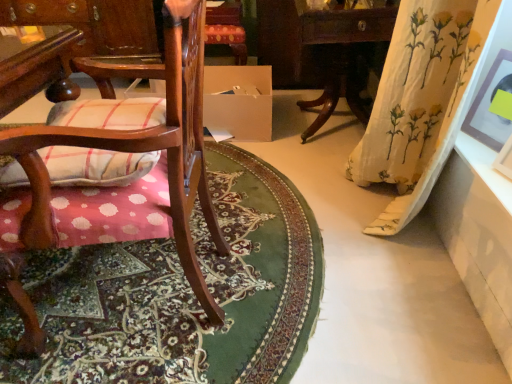
This screenshot has width=512, height=384. Identify the location of matte brown picture frame at upper right. (489, 105).

Image resolution: width=512 pixels, height=384 pixels. In order to click on wooden chair with cushion at left in this screenshot , I will do `click(114, 165)`.

The width and height of the screenshot is (512, 384). Find the location of `white glossy table at lower right, which ranks as the third table in back-to-front order`. white glossy table at lower right, which ranks as the third table in back-to-front order is located at coordinates (479, 234).

The height and width of the screenshot is (384, 512). I want to click on white floral fabric curtain at right, so click(420, 89).

Is carpeted floor mat at lower left positioned beyond the bounds of white cardboard box at center?

Yes, carpeted floor mat at lower left is not within white cardboard box at center.

From a real-world perspective, which is physically above, carpeted floor mat at lower left or white cardboard box at center?

white cardboard box at center, from a real-world perspective.

I want to click on cardboard box above the carpeted floor mat at lower left (from the image's perspective), so click(239, 101).

Between carpeted floor mat at lower left and white cardboard box at center, which one has more height?

white cardboard box at center is taller.

Is wooden table at left, arranged as the third table when viewed from the front, taller or shorter than wooden chair with cushion at left?

wooden table at left, arranged as the third table when viewed from the front, is shorter than wooden chair with cushion at left.

How different are the orientations of wooden table at left, which is the first table from back to front, and wooden chair with cushion at left in degrees?

There is a 90.4-degree angle between the facing directions of wooden table at left, which is the first table from back to front, and wooden chair with cushion at left.

From a real-world perspective, does wooden table at left, which is the first table from back to front, stand above wooden chair with cushion at left?

Incorrect, from a real-world perspective, wooden table at left, which is the first table from back to front, is lower than wooden chair with cushion at left.

Is wooden table at left, arranged as the third table when viewed from the front, oriented away from wooden chair with cushion at left?

No.

Is white floral fabric curtain at right beside carpeted floor mat at lower left?

white floral fabric curtain at right and carpeted floor mat at lower left are clearly separated.

How many degrees apart are the facing directions of white floral fabric curtain at right and carpeted floor mat at lower left?

They differ by 94.3 degrees in their facing directions.

Considering the relative positions of white floral fabric curtain at right and carpeted floor mat at lower left in the image provided, is white floral fabric curtain at right behind carpeted floor mat at lower left?

No, the depth of white floral fabric curtain at right is less than that of carpeted floor mat at lower left.

Would you say white floral fabric curtain at right is inside or outside carpeted floor mat at lower left?

white floral fabric curtain at right is not enclosed by carpeted floor mat at lower left.

Who is bigger, carpeted floor mat at lower left or white glossy table at lower right, which is the 3th table in left-to-right order?

carpeted floor mat at lower left.

Is carpeted floor mat at lower left facing towards white glossy table at lower right, the 1th table positioned from the right?

No, carpeted floor mat at lower left does not turn towards white glossy table at lower right, the 1th table positioned from the right.

Is wooden chair with cushion at left completely or partially outside of white floral fabric curtain at right?

Absolutely, wooden chair with cushion at left is external to white floral fabric curtain at right.

Considering the sizes of objects wooden chair with cushion at left and white floral fabric curtain at right in the image provided, who is shorter, wooden chair with cushion at left or white floral fabric curtain at right?

Standing shorter between the two is white floral fabric curtain at right.

Is wooden chair with cushion at left in front of or behind white floral fabric curtain at right in the image?

Result: wooden chair with cushion at left is in front of white floral fabric curtain at right.

Which is in front, point (181, 191) or point (458, 104)?

Positioned in front is point (181, 191).

Locate an element on the screen. Image resolution: width=512 pixels, height=384 pixels. chair below the matte brown picture frame at upper right (from the image's perspective) is located at coordinates (114, 165).

Is wooden chair with cushion at left at the right side of matte brown picture frame at upper right?

No, wooden chair with cushion at left is not to the right of matte brown picture frame at upper right.

Does point (54, 110) appear closer or farther from the camera than point (499, 69)?

Clearly, point (54, 110) is closer to the camera than point (499, 69).

How far apart are wooden chair with cushion at left and matte brown picture frame at upper right?

The distance of wooden chair with cushion at left from matte brown picture frame at upper right is 3.71 feet.

From the image's perspective, is matte brown picture frame at upper right located above or below wooden table at left, arranged as the third table when viewed from the front?

From the image's perspective, matte brown picture frame at upper right appears below wooden table at left, arranged as the third table when viewed from the front.

Considering the sizes of matte brown picture frame at upper right and wooden table at left, which is the first table from back to front, in the image, is matte brown picture frame at upper right taller or shorter than wooden table at left, which is the first table from back to front,?

matte brown picture frame at upper right is shorter than wooden table at left, which is the first table from back to front.

Does matte brown picture frame at upper right lie in front of wooden table at left, arranged as the third table when viewed from the front?

Yes.

What are the coordinates of `cardboard box lying behind the carpeted floor mat at lower left` in the screenshot? It's located at (239, 101).

The width and height of the screenshot is (512, 384). Identify the location of chair located on the right of wooden table at left, the third table viewed from the right. (114, 165).

Looking at the image, which one is located closer to white floral fabric curtain at right, wooden chair with cushion at left or plaid fabric cushion at left?

wooden chair with cushion at left lies closer to white floral fabric curtain at right than the other object.

When comparing their distances from matte brown picture frame at upper right, does white glossy table at lower right, the 1th table positioned from the right, or plaid fabric cushion at left seem further?

plaid fabric cushion at left is positioned further to the anchor matte brown picture frame at upper right.

Considering their positions, is white cardboard box at center positioned closer to white glossy table at lower right, which is the 3th table in left-to-right order, than white floral fabric curtain at right?

Based on the image, white floral fabric curtain at right appears to be nearer to white glossy table at lower right, which is the 3th table in left-to-right order.

From the image, which object appears to be nearer to matte brown picture frame at upper right, wooden table at left, the third table viewed from the right, or carpeted floor mat at lower left?

Based on the image, carpeted floor mat at lower left appears to be nearer to matte brown picture frame at upper right.

Which object lies nearer to the anchor point plaid fabric cushion at left, matte brown picture frame at upper right or wooden table at right, the 2th table from the front?

matte brown picture frame at upper right is positioned closer to the anchor plaid fabric cushion at left.

Considering their positions, is plaid fabric cushion at left positioned further to wooden table at left, arranged as the third table when viewed from the front, than wooden table at right, acting as the 2th table starting from the back?

Based on the image, plaid fabric cushion at left appears to be further to wooden table at left, arranged as the third table when viewed from the front.

Based on their spatial positions, is plaid fabric cushion at left or white floral fabric curtain at right further from matte brown picture frame at upper right?

plaid fabric cushion at left is positioned further to the anchor matte brown picture frame at upper right.

Considering their positions, is white cardboard box at center positioned closer to plaid fabric cushion at left than white glossy table at lower right, the 1th table positioned from the right?

white glossy table at lower right, the 1th table positioned from the right, is positioned closer to the anchor plaid fabric cushion at left.

Image resolution: width=512 pixels, height=384 pixels. I want to click on curtain between wooden chair with cushion at left and wooden table at right, the second table from the right, along the z-axis, so click(420, 89).

What are the coordinates of `picture frame located between white glossy table at lower right, which is the 3th table in left-to-right order, and white cardboard box at center in the depth direction` in the screenshot? It's located at (489, 105).

Image resolution: width=512 pixels, height=384 pixels. Find the location of `curtain located between wooden table at left, arranged as the 1th table when viewed from the left, and white glossy table at lower right, the 1th table positioned from the right, in the left-right direction`. curtain located between wooden table at left, arranged as the 1th table when viewed from the left, and white glossy table at lower right, the 1th table positioned from the right, in the left-right direction is located at coordinates (420, 89).

Identify the location of picture frame between carpeted floor mat at lower left and white cardboard box at center in the front-back direction. The height and width of the screenshot is (384, 512). (489, 105).